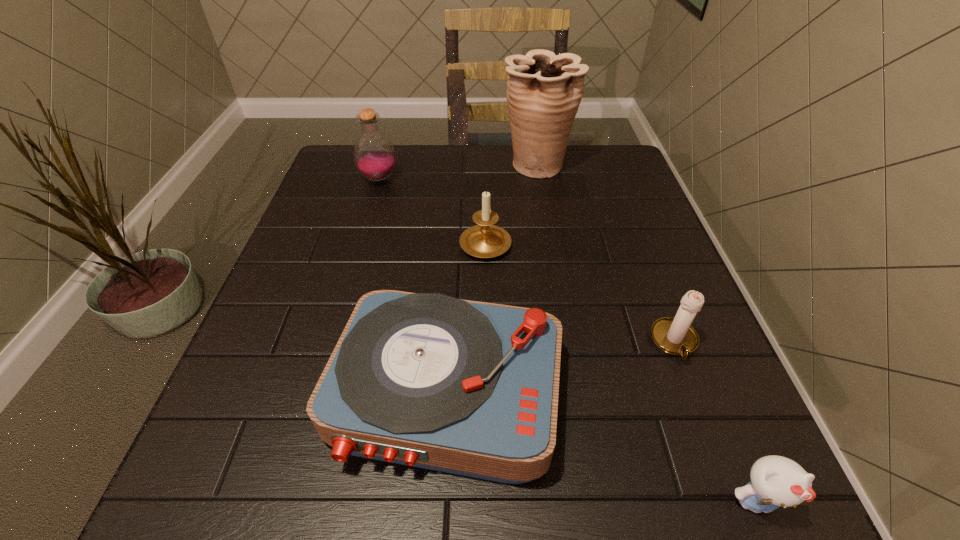
Where is `urn`? The width and height of the screenshot is (960, 540). urn is located at coordinates (544, 91).

You are a GUI agent. You are given a task and a screenshot of the screen. Output one action in this format:
    pyautogui.click(x=<x>, y=<y>)
    Task: Click on the fifth shortest object
    The width and height of the screenshot is (960, 540).
    Given the screenshot: What is the action you would take?
    pyautogui.click(x=374, y=155)

This screenshot has height=540, width=960. In order to click on the left candle holder in this screenshot , I will do pyautogui.click(x=485, y=240).

Find the location of a particular element. The image size is (960, 540). the farther candle holder is located at coordinates (485, 240).

Find the location of `the right candle holder`. the right candle holder is located at coordinates (676, 336).

Where is `record player`? record player is located at coordinates (471, 388).

Locate an element on the screen. Image resolution: width=960 pixels, height=540 pixels. kitten is located at coordinates (776, 481).

Where is `blank space located 0.220m on the front of the tallest object`? This screenshot has height=540, width=960. blank space located 0.220m on the front of the tallest object is located at coordinates (549, 240).

This screenshot has height=540, width=960. Find the location of `vacant point located on the right of the second tallest object`. vacant point located on the right of the second tallest object is located at coordinates (552, 179).

The image size is (960, 540). Find the location of `free space located with a handle on the side of the farther candle holder`. free space located with a handle on the side of the farther candle holder is located at coordinates (484, 163).